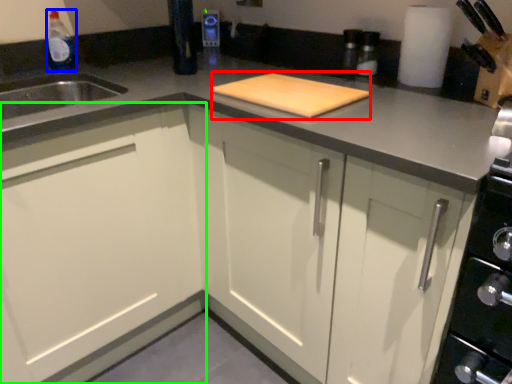
Question: Based on their relative distances, which object is nearer to cutting board (highlighted by a red box)? Choose from bottle (highlighted by a blue box) and cabinetry (highlighted by a green box).

Choices:
 (A) bottle
 (B) cabinetry

Answer: (B)